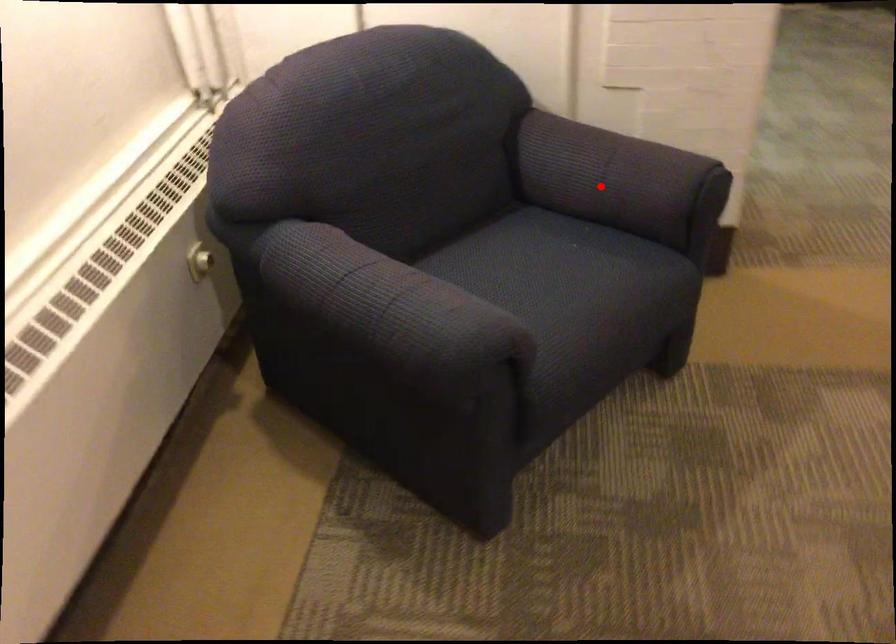
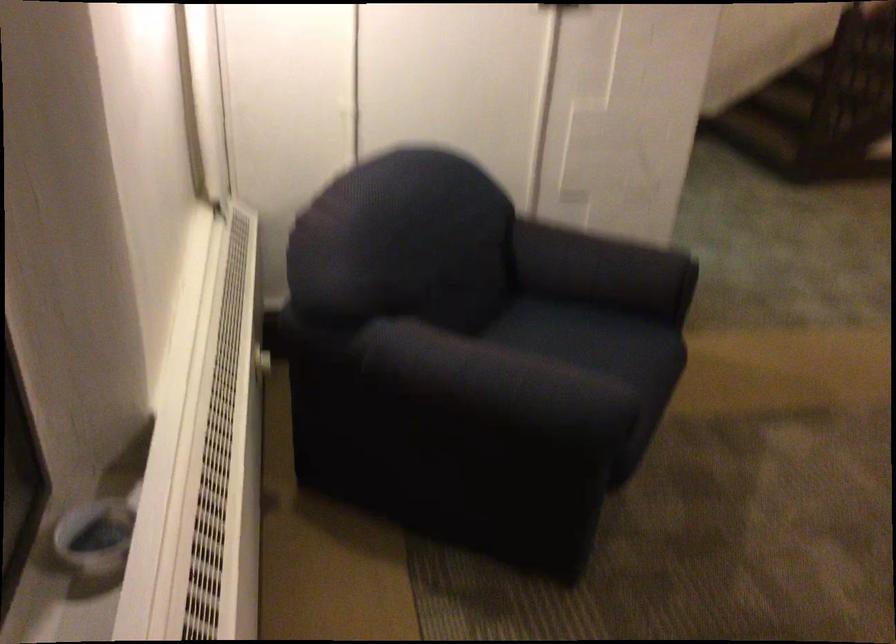
Question: A red point is marked in image1. In image2, is the corresponding 3D point closer to the camera or farther? Reply with the corresponding letter.

Choices:
 (A) The corresponding 3D point is closer.
 (B) The corresponding 3D point is farther.

Answer: (B)